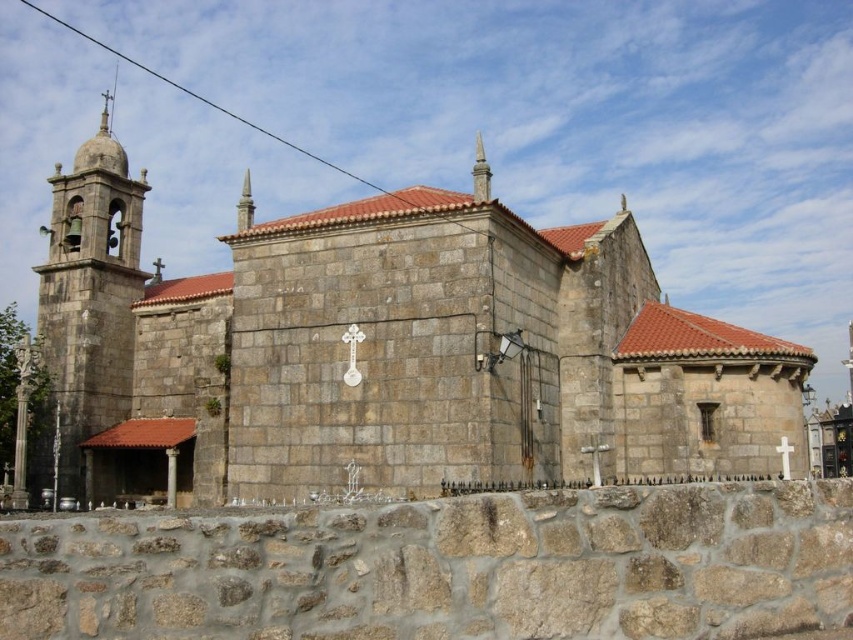
Question: Can you confirm if stone church at center is smaller than stone bell tower at upper left?

Choices:
 (A) no
 (B) yes

Answer: (A)

Question: Which point appears closest to the camera in this image?

Choices:
 (A) (96, 404)
 (B) (83, 365)

Answer: (B)

Question: Is stone church at center to the right of stone bell tower at upper left from the viewer's perspective?

Choices:
 (A) no
 (B) yes

Answer: (B)

Question: Which point is closer to the camera taking this photo?

Choices:
 (A) (76, 332)
 (B) (485, 276)

Answer: (B)

Question: Is stone church at center to the right of stone bell tower at upper left from the viewer's perspective?

Choices:
 (A) yes
 (B) no

Answer: (A)